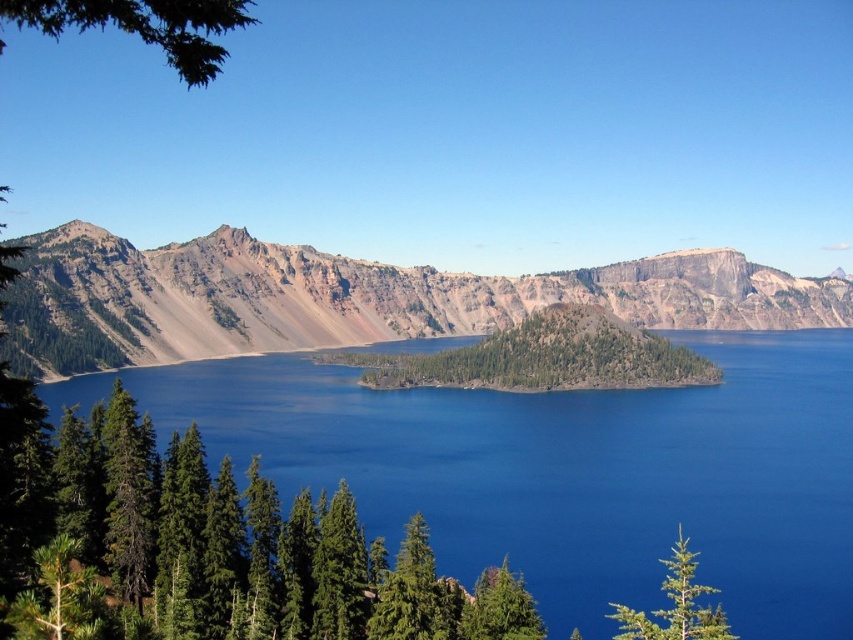
Can you confirm if brown rocky mountain at left is bigger than green needle-like tree at lower left?

Correct, brown rocky mountain at left is larger in size than green needle-like tree at lower left.

Locate an element on the screen. The width and height of the screenshot is (853, 640). brown rocky mountain at left is located at coordinates (347, 298).

Between point (273, 305) and point (70, 625), which one is positioned in front?

Point (70, 625) is more forward.

This screenshot has width=853, height=640. What are the coordinates of `brown rocky mountain at left` in the screenshot? It's located at click(347, 298).

Describe the element at coordinates (543, 356) in the screenshot. This screenshot has height=640, width=853. I see `green leafy island at center` at that location.

Can you confirm if green leafy island at center is positioned below green matte tree at lower right?

Actually, green leafy island at center is above green matte tree at lower right.

Measure the distance between green leafy island at center and camera.

The distance of green leafy island at center from camera is 662.08 feet.

Where is `green leafy island at center`? green leafy island at center is located at coordinates (543, 356).

Who is taller, green textured tree at lower center or green matte tree at lower center?

green textured tree at lower center is taller.

Which is above, green textured tree at lower center or green matte tree at lower center?

green textured tree at lower center

Is point (442, 632) more distant than point (518, 620)?

That is False.

The image size is (853, 640). Find the location of `green textured tree at lower center`. green textured tree at lower center is located at coordinates (415, 593).